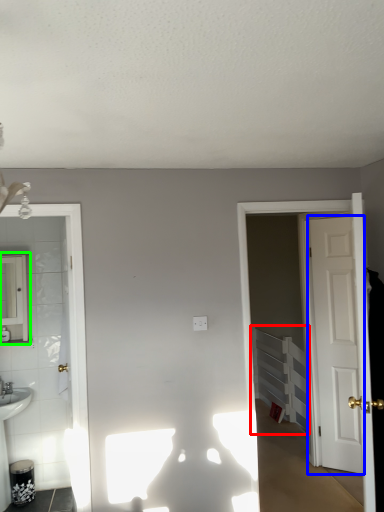
Question: Which object is positioned closest to radiator (highlighted by a red box)? Select from door (highlighted by a blue box) and mirror (highlighted by a green box).

Choices:
 (A) door
 (B) mirror

Answer: (A)